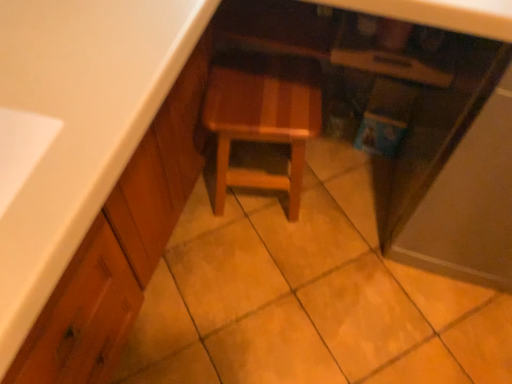
Where is `free space in front of wooden stool at center`? free space in front of wooden stool at center is located at coordinates (252, 259).